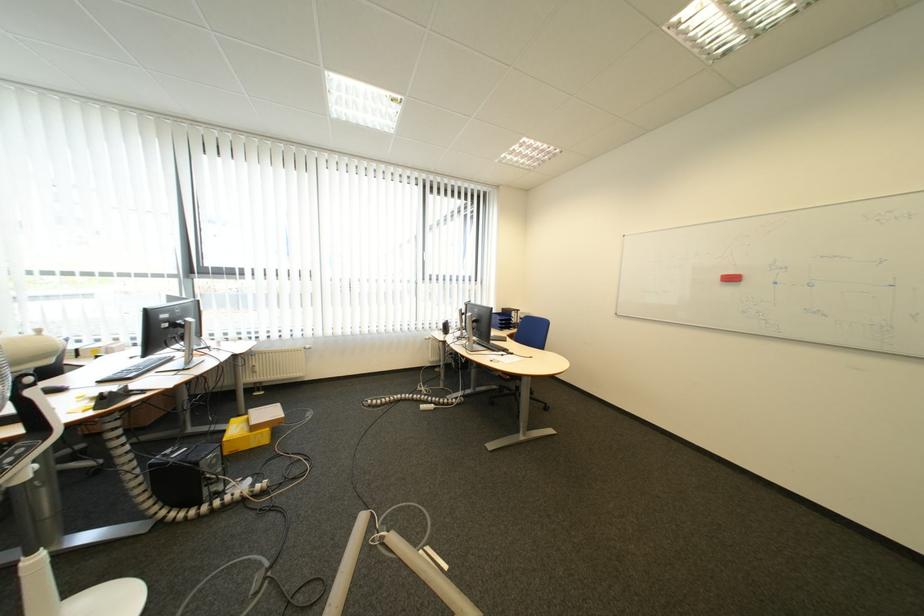
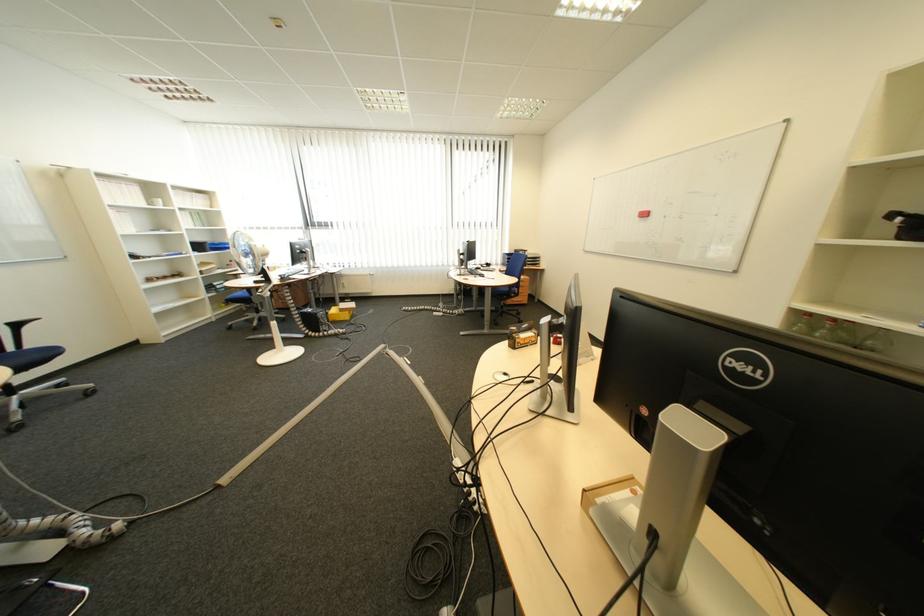
In the scene shown: What movement of the cameraman would produce the second image?

The cameraman moved toward right, backward.